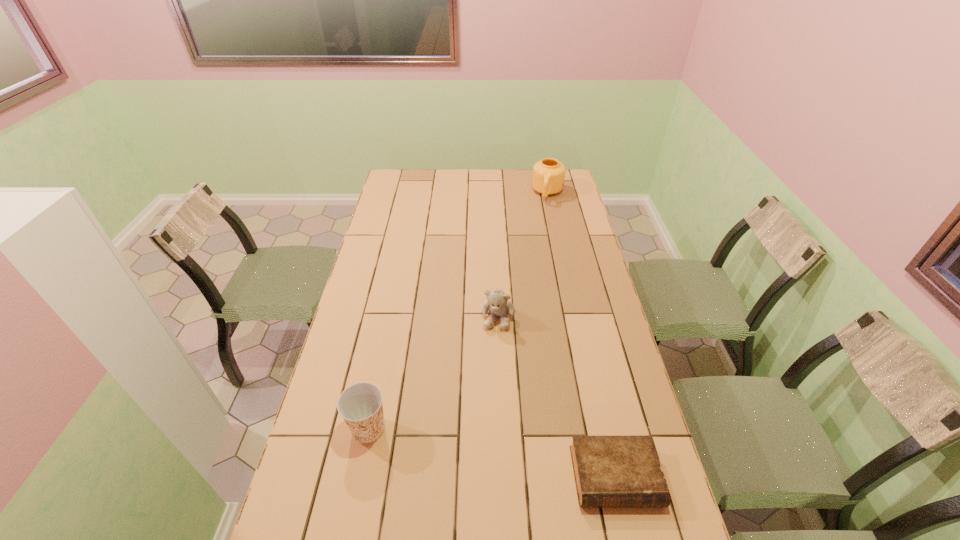
Image resolution: width=960 pixels, height=540 pixels. What are the coordinates of `vacant point located between the Dixie cup and the second farthest object` in the screenshot? It's located at (433, 373).

Identify the location of blank region between the diary and the Dixie cup. The image size is (960, 540). (492, 453).

The image size is (960, 540). I want to click on vacant area that lies between the shortest object and the leftmost object, so click(x=492, y=453).

The width and height of the screenshot is (960, 540). I want to click on vacant space that is in between the Dixie cup and the farthest object, so click(458, 311).

The image size is (960, 540). I want to click on object that is the second closest to the farthest object, so click(620, 471).

This screenshot has width=960, height=540. Identify the location of object that is the nearest to the diary. (497, 303).

The image size is (960, 540). Identify the location of free space that satisfies the following two spatial constraints: 1. on the back side of the mug; 2. on the left side of the teddy bear. (492, 193).